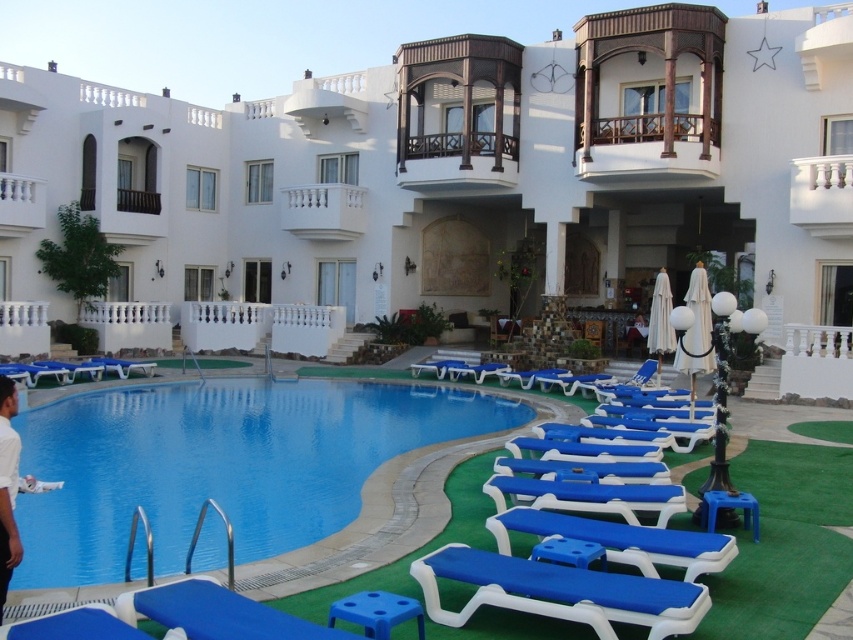
You are a GUI agent. You are given a task and a screenshot of the screen. Output one action in this format:
    pyautogui.click(x=<x>, y=<y>)
    Task: Click on the blue plastic pool at center
    This screenshot has width=853, height=640.
    Given the screenshot: What is the action you would take?
    pyautogui.click(x=219, y=464)

Is blue plastic pool at center bigger than blue plastic chair at lower center?

Indeed, blue plastic pool at center has a larger size compared to blue plastic chair at lower center.

Which is behind, point (314, 442) or point (517, 506)?

Positioned behind is point (314, 442).

What are the coordinates of `blue plastic pool at center` in the screenshot? It's located at (219, 464).

Which is above, blue plastic chair at center or white cotton shirt at lower left?

white cotton shirt at lower left is higher up.

Does point (662, 486) come in front of point (0, 604)?

No, it is behind (0, 604).

Where is `blue plastic chair at center`? blue plastic chair at center is located at coordinates (589, 497).

This screenshot has width=853, height=640. Identify the location of blue plastic chair at center. (589, 497).

Does blue plastic pool at center have a greater width compared to white cotton shirt at lower left?

Correct, the width of blue plastic pool at center exceeds that of white cotton shirt at lower left.

Based on the photo, does blue plastic pool at center have a greater height compared to white cotton shirt at lower left?

No, blue plastic pool at center is not taller than white cotton shirt at lower left.

This screenshot has width=853, height=640. What are the coordinates of `blue plastic pool at center` in the screenshot? It's located at (219, 464).